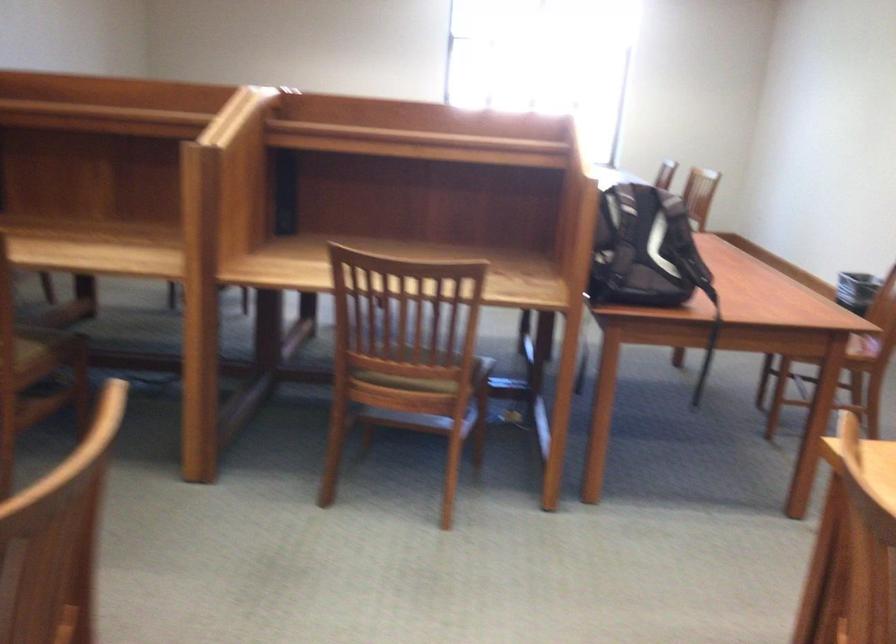
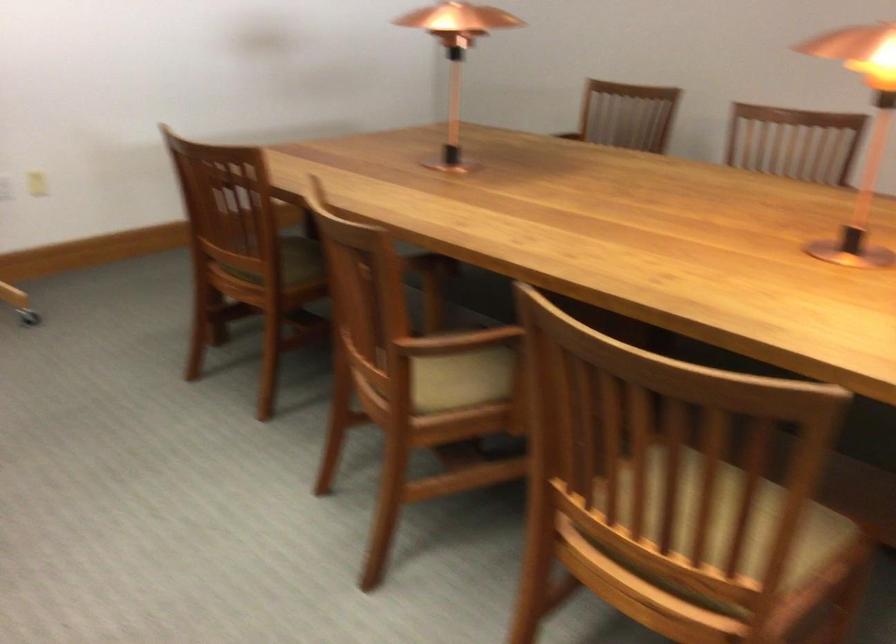
In the second image, find the point that corresponds to (72,567) in the first image.

(728, 526)